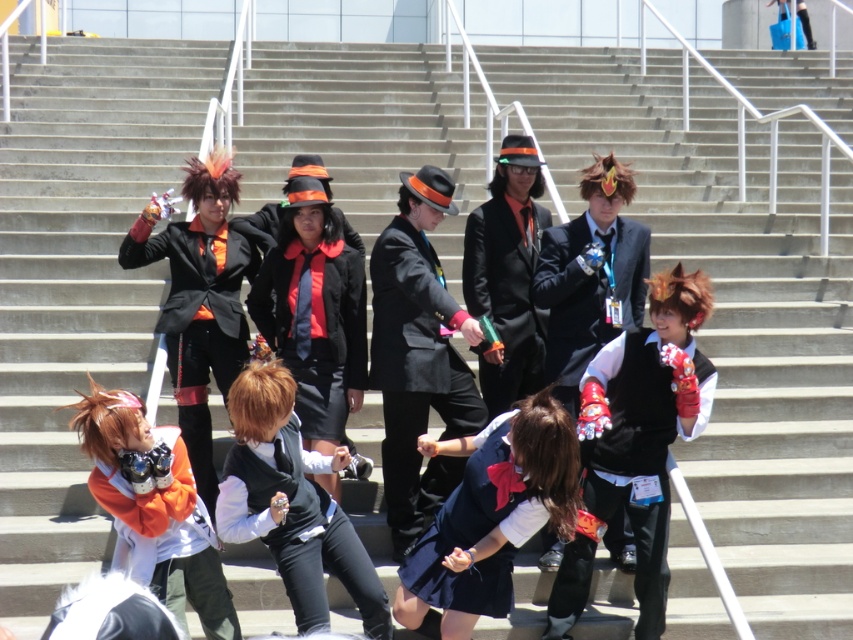
Consider the image. Can you confirm if black matte suit at center is thinner than matte black jacket at center?

Yes, black matte suit at center is thinner than matte black jacket at center.

Does point (410, 308) lie behind point (308, 193)?

That is True.

The width and height of the screenshot is (853, 640). Identify the location of black matte suit at center. (416, 372).

Between velvet black vest at center and matte black vest at center, which one has more height?

With more height is matte black vest at center.

Does velvet black vest at center have a greater width compared to matte black vest at center?

Yes, velvet black vest at center is wider than matte black vest at center.

Describe the element at coordinates (642, 442) in the screenshot. I see `velvet black vest at center` at that location.

The image size is (853, 640). I want to click on velvet black vest at center, so click(x=642, y=442).

Which is more to the right, matte blue skirt at center or matte black suit at center?

From the viewer's perspective, matte black suit at center appears more on the right side.

Which is in front, point (451, 547) or point (509, 232)?

Positioned in front is point (451, 547).

This screenshot has width=853, height=640. What are the coordinates of `matte blue skirt at center` in the screenshot? It's located at (491, 516).

Locate an element on the screen. This screenshot has height=640, width=853. matte blue skirt at center is located at coordinates (491, 516).